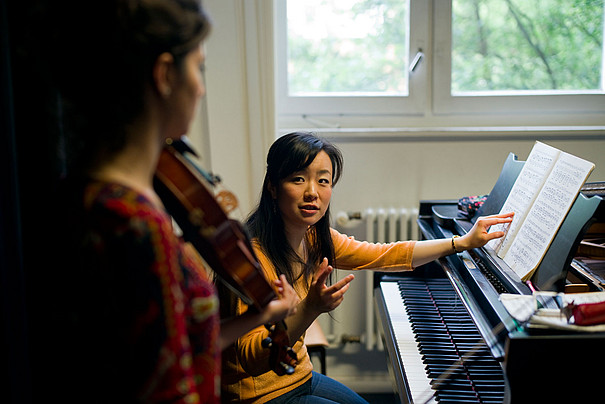
The height and width of the screenshot is (404, 605). What are the coordinates of `window panes` in the screenshot? It's located at (381, 45), (499, 70).